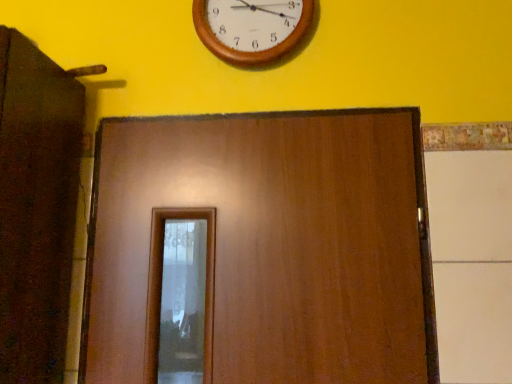
Describe the element at coordinates (252, 29) in the screenshot. I see `wooden clock at upper center` at that location.

Locate an element on the screen. wooden clock at upper center is located at coordinates pos(252,29).

Identify the location of wooden clock at upper center. This screenshot has height=384, width=512. (252, 29).